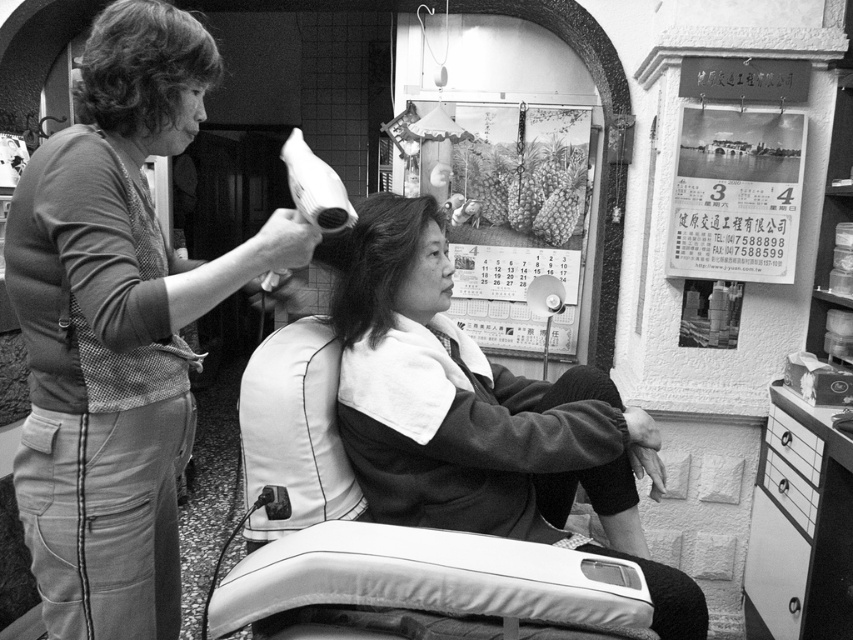
In the hair salon scene, you see curly hair at upper left and smooth hair at center. Which of these two hair types is positioned to the left?

The curly hair at upper left is positioned to the left of the smooth hair at center.

Consider the image. You are a photographer positioned at the camera. You want to capture a closeup of the curly hair at upper left. Given that your camera has a minimum focusing distance of 1 meter, will you be able to take the photo without moving closer?

The distance between the curly hair at upper left and the camera is 1.20 meters, which is greater than the camera minimum focusing distance of 1 meter. Therefore, you can take the photo without moving closer.